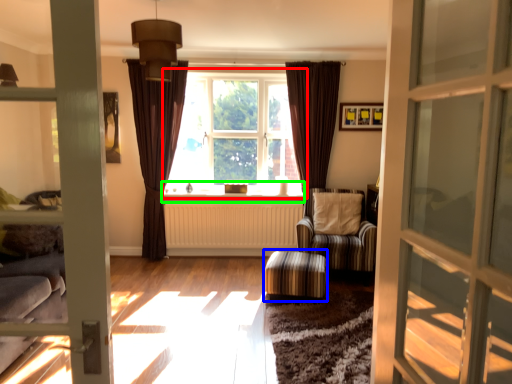
Question: Which is farther away from window (highlighted by a red box)? stool (highlighted by a blue box) or window sill (highlighted by a green box)?

Choices:
 (A) stool
 (B) window sill

Answer: (A)